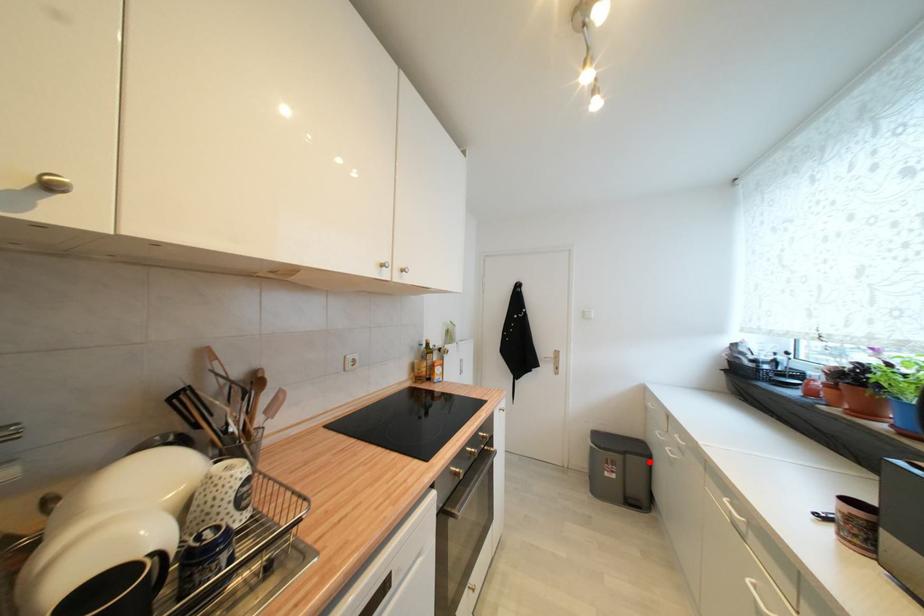
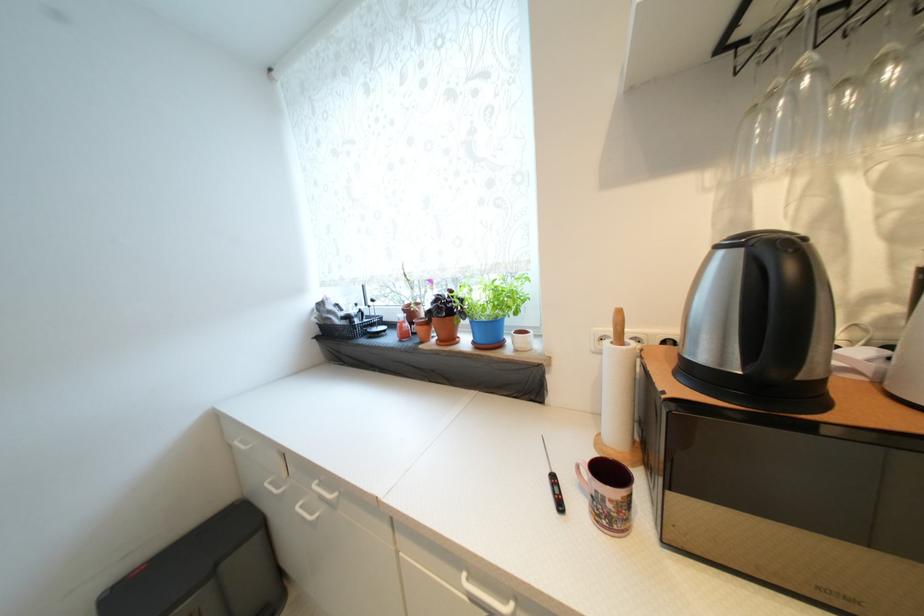
The point at the highlighted location is marked in the first image. Where is the corresponding point in the second image?

(261, 541)